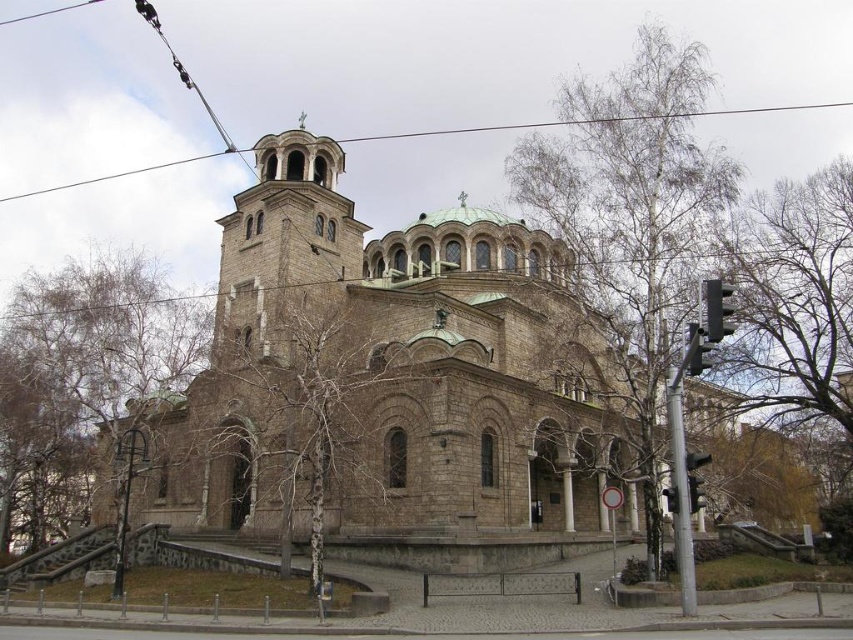
You are a photographer planning to capture the brown stone church at center and the metallic wire at upper center in a single shot. Which object will appear narrower in the photo?

The brown stone church at center is thinner than the metallic wire at upper center, so it will appear narrower in the photo.

You are standing in front of the church and notice two elements in the image. One is the brown stone church at center, and the other is the metallic wire at upper center. Based on their positions, which one is closer to your left side?

The metallic wire at upper center is closer to your left side because the brown stone church at center is to the right of it.